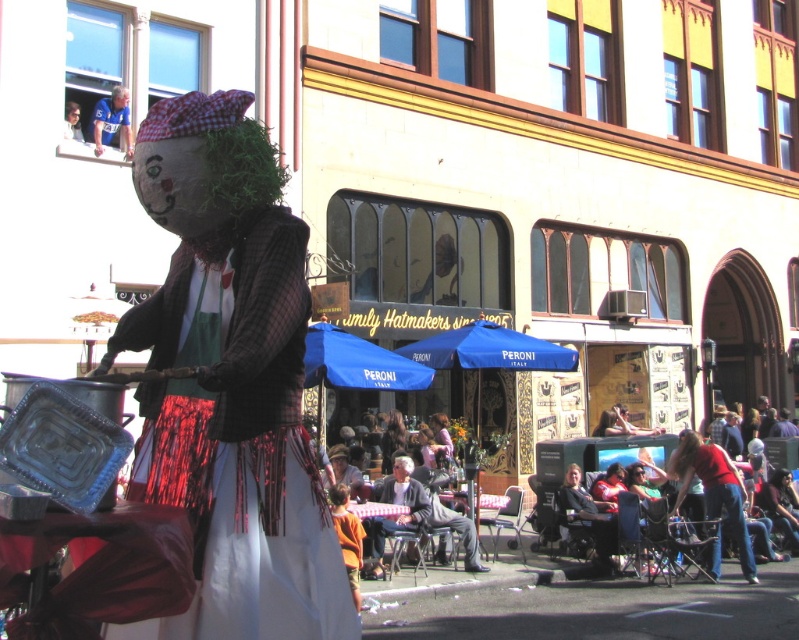
The width and height of the screenshot is (799, 640). Describe the element at coordinates (240, 440) in the screenshot. I see `matte plaid shirt at center` at that location.

Is matte plaid shirt at center wider than dark gray suit at center?

Indeed, matte plaid shirt at center has a greater width compared to dark gray suit at center.

Which is in front, point (161, 353) or point (426, 504)?

Point (161, 353)

Locate an element on the screen. matte plaid shirt at center is located at coordinates coord(240,440).